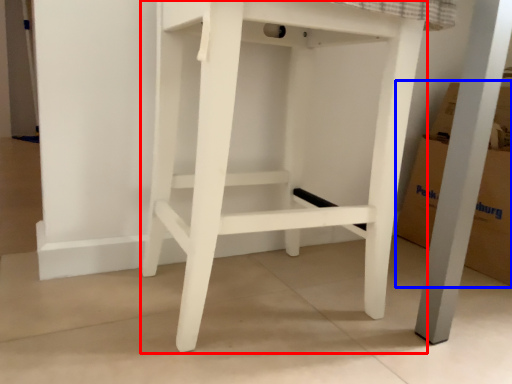
Question: Which of the following is the farthest to the observer, furniture (highlighted by a red box) or cardboard box (highlighted by a blue box)?

Choices:
 (A) furniture
 (B) cardboard box

Answer: (B)